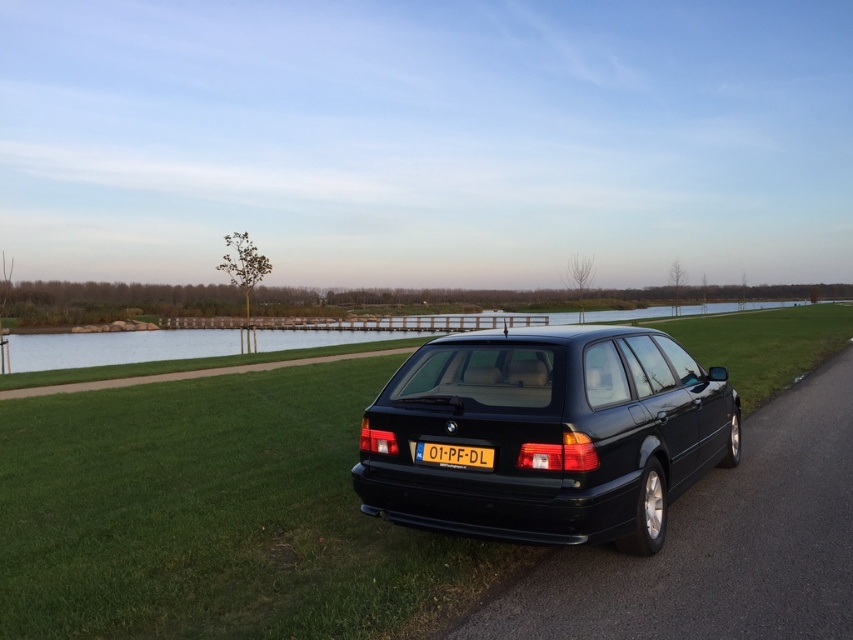
Question: Which is farther from the glossy black station wagon at center?

Choices:
 (A) yellow plastic license plate at center
 (B) green grass at center

Answer: (B)

Question: Considering the relative positions of glossy black station wagon at center and yellow plastic license plate at center in the image provided, where is glossy black station wagon at center located with respect to yellow plastic license plate at center?

Choices:
 (A) right
 (B) left

Answer: (B)

Question: Which of the following is the farthest from the observer?

Choices:
 (A) (428, 458)
 (B) (592, 493)

Answer: (A)

Question: Which of the following is the closest to the observer?

Choices:
 (A) green grass at center
 (B) glossy black station wagon at center

Answer: (A)

Question: Is glossy black station wagon at center bigger than yellow plastic license plate at center?

Choices:
 (A) no
 (B) yes

Answer: (B)

Question: Can you confirm if green grass at center is thinner than yellow plastic license plate at center?

Choices:
 (A) yes
 (B) no

Answer: (B)